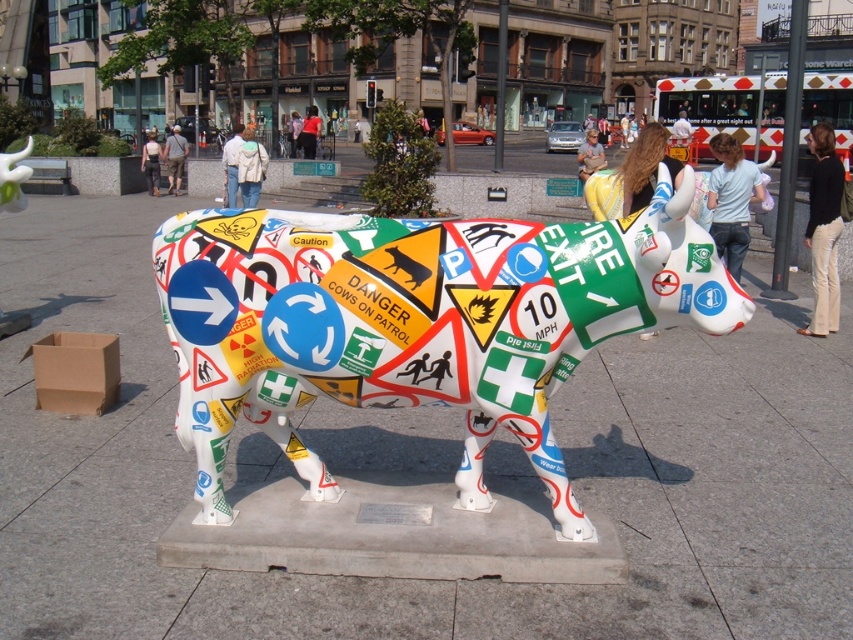
Question: Can you confirm if white glossy cow at center is positioned to the right of denim jeans at center?

Choices:
 (A) no
 (B) yes

Answer: (B)

Question: Which point is farther to the camera?

Choices:
 (A) (537, 426)
 (B) (148, 186)

Answer: (B)

Question: Can you confirm if light blue denim jeans at center right is smaller than light beige jacket at center?

Choices:
 (A) no
 (B) yes

Answer: (A)

Question: Which point is closer to the camera taking this photo?

Choices:
 (A) (747, 168)
 (B) (149, 161)

Answer: (A)

Question: Can you confirm if light blue denim jeans at center right is positioned below light beige jacket at center?

Choices:
 (A) no
 (B) yes

Answer: (A)

Question: Based on their relative distances, which object is nearer to the light beige jacket at center?

Choices:
 (A) white glossy cow at center
 (B) denim jeans at center

Answer: (B)